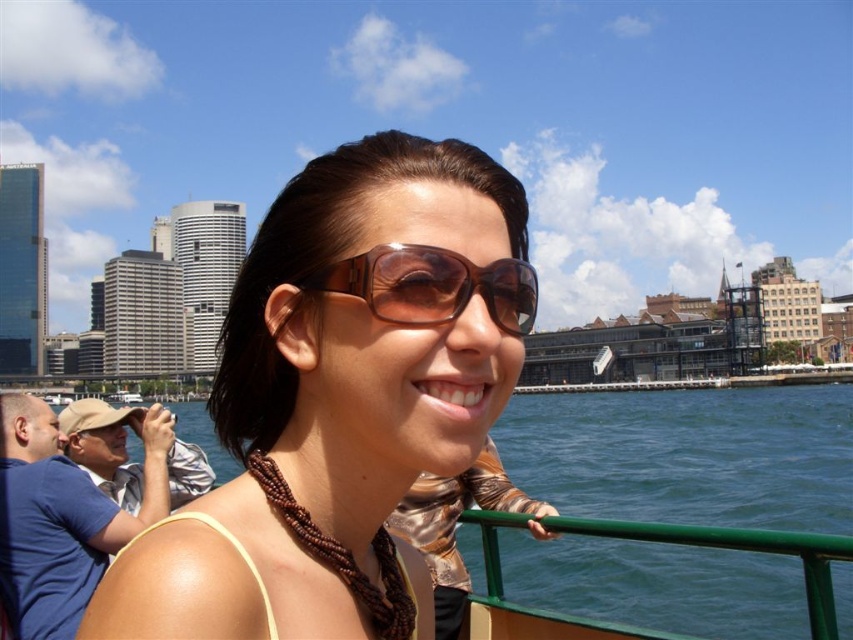
From the picture: You are a photographer trying to capture the woman wearing the brown leather sunglasses at center and the brown shiny sunglasses at center. Since both sunglasses are at the center, how can you differentiate them in your shot?

The brown leather sunglasses at center is larger in size than the brown shiny sunglasses at center, so you can differentiate them by focusing on the size difference between the two.

What is the exact location of the blue water at lower right in the image?

The blue water at lower right is located at point (665, 509).

You are a photographer trying to capture a shot of the brown leather sunglasses at center and the blue water at lower right. Since you want both subjects in focus, which one should you prioritize focusing on first?

You should prioritize focusing on the brown leather sunglasses at center first because it is closer to the viewer than the blue water at lower right.